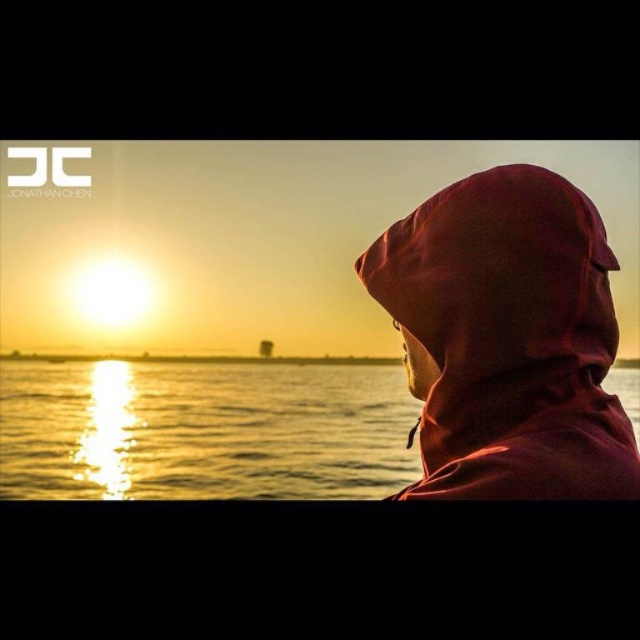
You are a photographer trying to capture the sunset scene. You notice the matte red hoodie at upper right and the shiny metallic water at center. Which object is positioned closer to you in the image?

The matte red hoodie at upper right is closer to the viewer than the shiny metallic water at center.

You are a photographer trying to capture the sunset scene. You want to frame the matte red hoodie at upper right and the shiny metallic water at center in your shot. Which object should you position closer to the left side of the frame?

The matte red hoodie at upper right is to the left of shiny metallic water at center, so you should position the matte red hoodie at upper right closer to the left side of the frame.